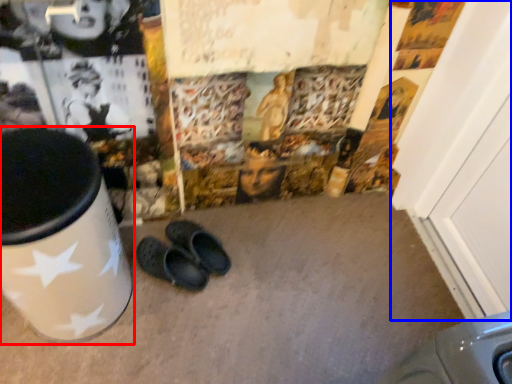
Question: Which of the following is the farthest to the observer, waste container (highlighted by a red box) or door (highlighted by a blue box)?

Choices:
 (A) waste container
 (B) door

Answer: (B)